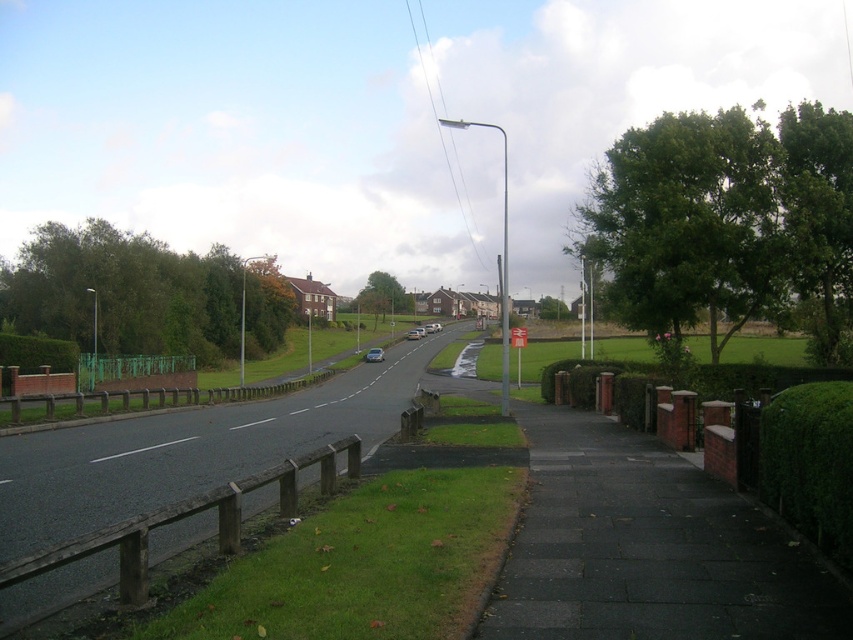
You are a delivery person trying to park your van, which is 2 meters wide, between the silver metallic sedan at center and the metallic silver car at center on the suburban street. Based on the scene, can your van fit in the space between them?

The silver metallic sedan at center is wider than the metallic silver car at center. However, since both vehicles are parked at the center of the scene, there might not be enough space between them for your 2 meter wide van to fit. You should look for another parking spot.

You are a pedestrian standing on the sidewalk and want to cross the road to reach the grassy area. There are two silver metallic vehicles in front of you. Which one is closer to the ground, the silver metallic car at center or the silver metallic sedan at center?

The silver metallic car at center is located below the silver metallic sedan at center, so the silver metallic car at center is closer to the ground.

You are a pedestrian standing on the sidewalk and want to cross the road to reach the grassy area. Which silver metallic vehicle is nearer to you, the silver metallic car at center or the silver metallic sedan at center?

The silver metallic car at center is closer to the viewer than the silver metallic sedan at center, so the silver metallic car at center is nearer to you.